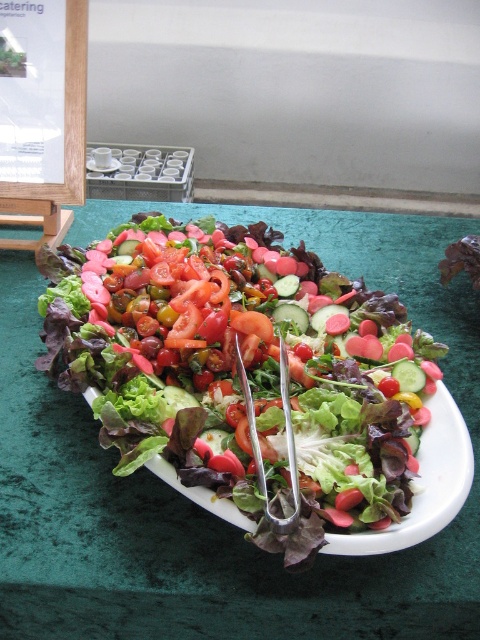
Question: Among these points, which one is farthest from the camera?

Choices:
 (A) 424,419
 (B) 94,161

Answer: (B)

Question: Can you confirm if fresh green salad at center is positioned below white ceramic plate at center?

Choices:
 (A) no
 (B) yes

Answer: (B)

Question: Can you confirm if fresh green salad at center is thinner than white ceramic plate at center?

Choices:
 (A) no
 (B) yes

Answer: (A)

Question: Does fresh green salad at center appear over white ceramic plate at center?

Choices:
 (A) no
 (B) yes

Answer: (A)